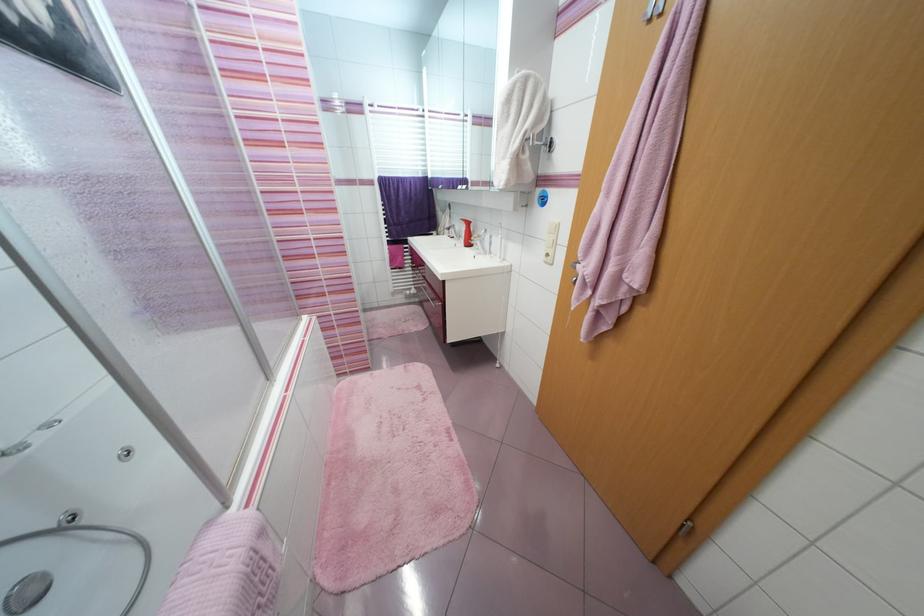
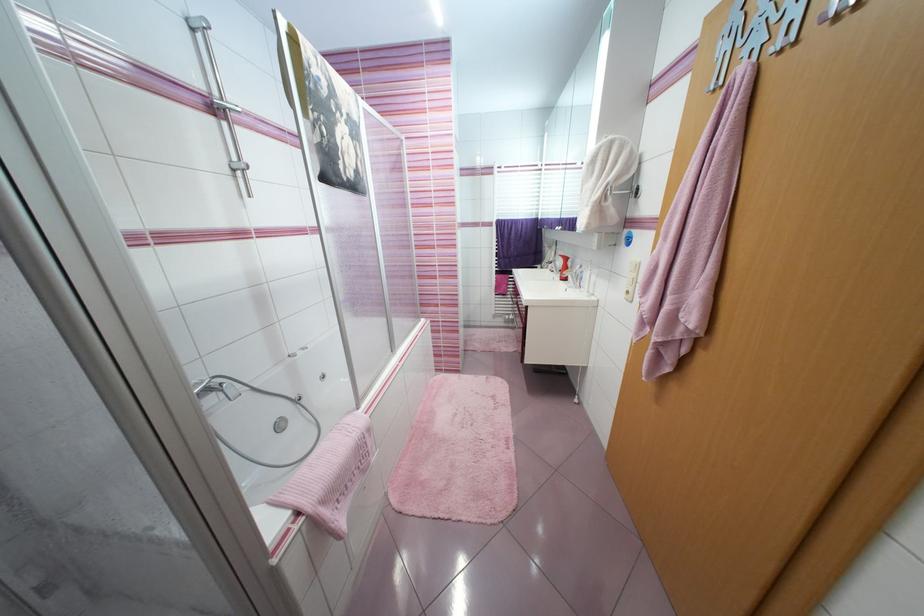
The point at (553, 256) is marked in the first image. Where is the corresponding point in the second image?

(633, 293)